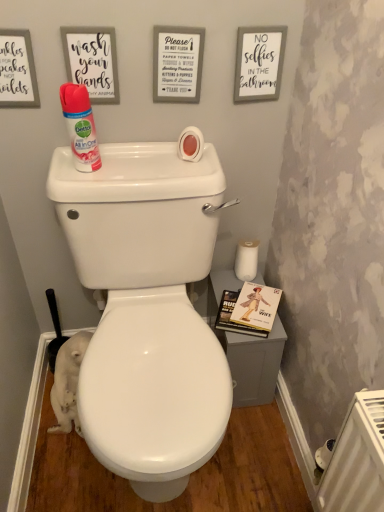
You are a GUI agent. You are given a task and a screenshot of the screen. Output one action in this format:
    pyautogui.click(x=<x>, y=<y>)
    Task: Click on the empty space that is ontop of hardcover book at right
    The height and width of the screenshot is (512, 384).
    Given the screenshot: What is the action you would take?
    pyautogui.click(x=254, y=304)